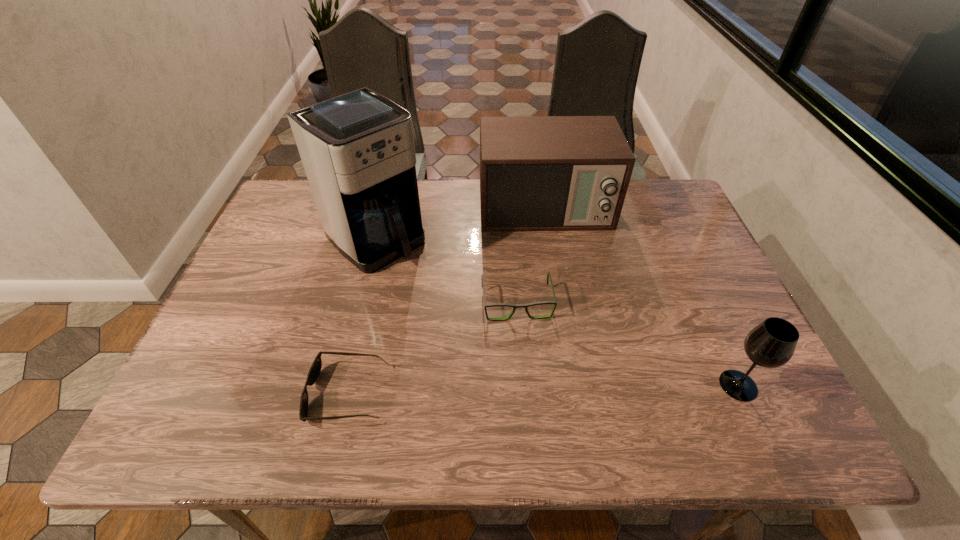
I want to click on vacant spot on the desktop that is between the shortest object and the rightmost object and is positioned on the lens of the fourth tallest object, so click(530, 390).

Locate an element on the screen. vacant spot on the desktop that is between the shortest object and the rightmost object and is positioned on the front panel of the coffee maker is located at coordinates (551, 389).

Image resolution: width=960 pixels, height=540 pixels. I want to click on free space on the desktop that is between the shortest object and the rightmost object and is positioned on the front-facing side of the radio receiver, so click(x=579, y=389).